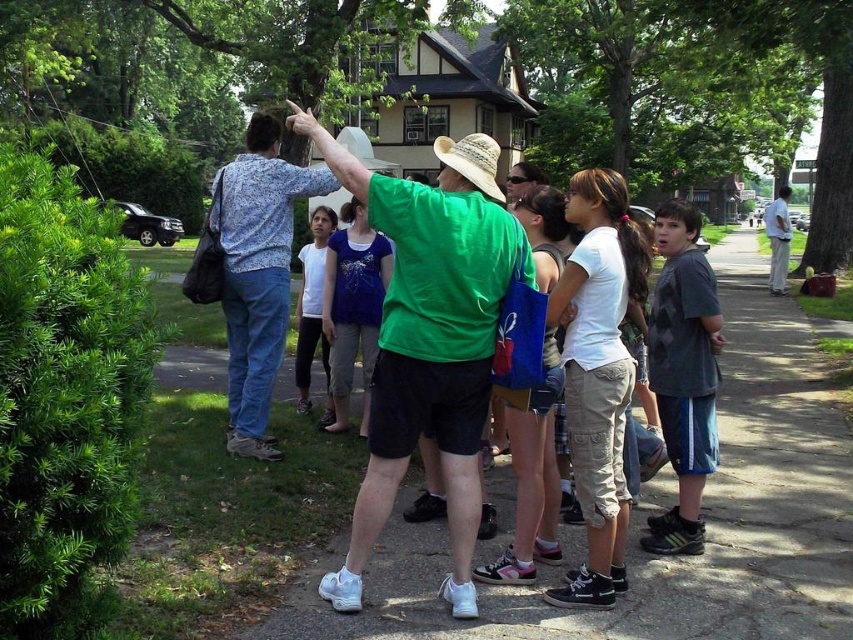
Question: Is straw cowboy hat at center wider than straw hat at center?

Choices:
 (A) no
 (B) yes

Answer: (A)

Question: Does straw cowboy hat at center have a greater width compared to straw hat at center?

Choices:
 (A) yes
 (B) no

Answer: (B)

Question: Among these objects, which one is nearest to the camera?

Choices:
 (A) straw cowboy hat at center
 (B) straw hat at center

Answer: (A)

Question: Can you confirm if straw cowboy hat at center is positioned above straw hat at center?

Choices:
 (A) no
 (B) yes

Answer: (A)